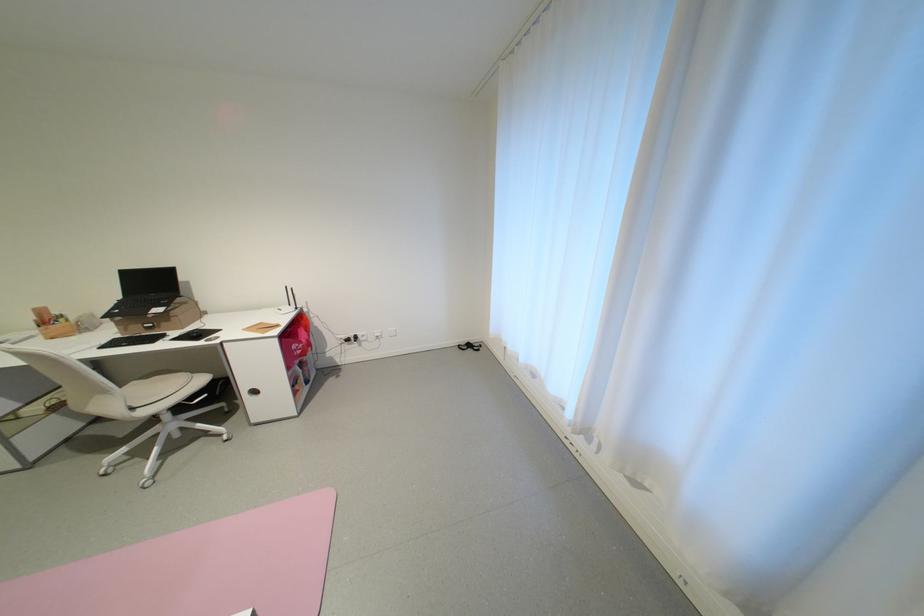
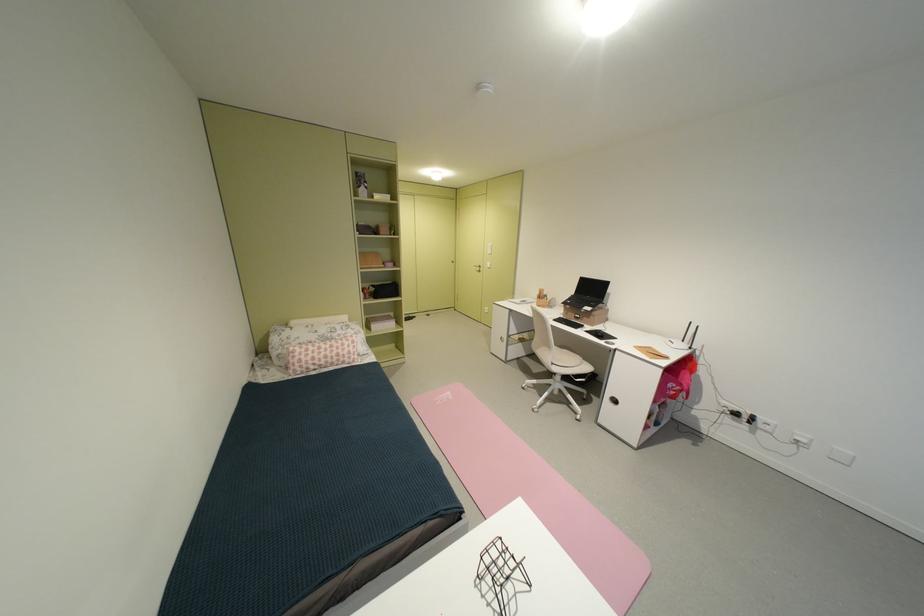
Question: The images are taken continuously from a first-person perspective. In which direction is your viewpoint rotating?

Choices:
 (A) Left
 (B) Right
 (C) Up
 (D) Down

Answer: (A)